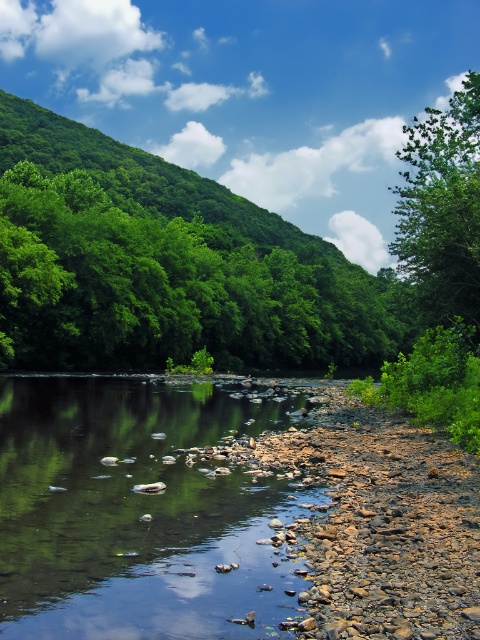
Can you confirm if smooth rock river at center is bigger than green leafy tree at upper right?

Incorrect, smooth rock river at center is not larger than green leafy tree at upper right.

Does smooth rock river at center appear on the right side of green leafy tree at upper right?

In fact, smooth rock river at center is to the left of green leafy tree at upper right.

At what (x,y) coordinates should I click in order to perform the action: click on smooth rock river at center. Please return your answer as a coordinate pair (x, y). This screenshot has width=480, height=640. Looking at the image, I should click on (140, 513).

Locate an element on the screen. The width and height of the screenshot is (480, 640). smooth rock river at center is located at coordinates 140,513.

In the scene shown: Who is positioned more to the left, green leafy hillside at upper left or smooth rock river at center?

green leafy hillside at upper left is more to the left.

Identify the location of green leafy hillside at upper left. The height and width of the screenshot is (640, 480). (167, 264).

From the picture: Who is more forward, [324,353] or [235,467]?

Point [235,467] is in front.

In order to click on green leafy hillside at upper left in this screenshot , I will do `click(167, 264)`.

Between green leafy hillside at upper left and green leafy tree at upper right, which one is positioned higher?

green leafy tree at upper right is above.

Which is below, green leafy hillside at upper left or green leafy tree at upper right?

green leafy hillside at upper left

Locate an element on the screen. Image resolution: width=480 pixels, height=640 pixels. green leafy hillside at upper left is located at coordinates (167, 264).

Locate an element on the screen. green leafy hillside at upper left is located at coordinates (167, 264).